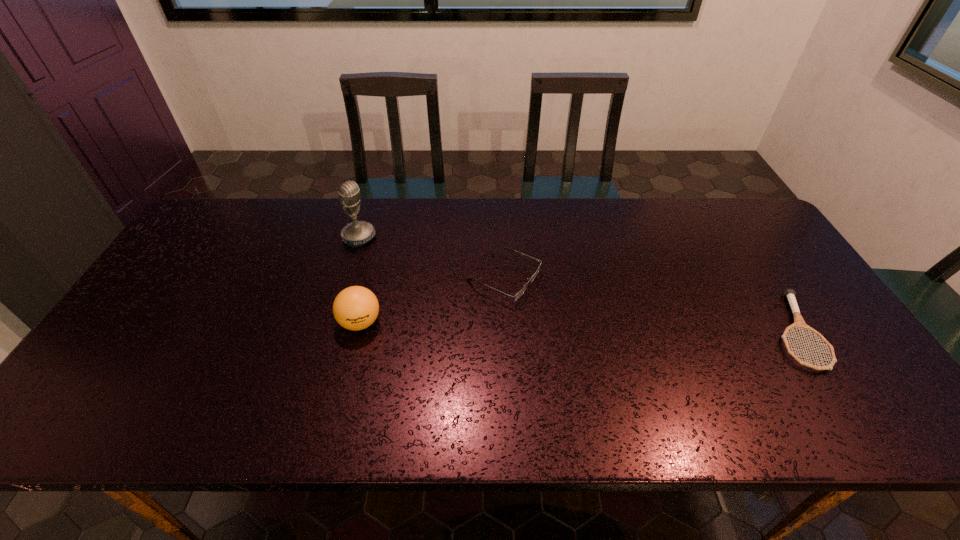
At what (x,y) coordinates should I click in order to perform the action: click on the third shortest object. Please return your answer as a coordinate pair (x, y). The height and width of the screenshot is (540, 960). Looking at the image, I should click on (355, 308).

The width and height of the screenshot is (960, 540). Identify the location of the rightmost object. (790, 294).

Image resolution: width=960 pixels, height=540 pixels. I want to click on the shortest object, so click(790, 294).

What are the coordinates of `the tallest object` in the screenshot? It's located at (357, 233).

You are a GUI agent. You are given a task and a screenshot of the screen. Output one action in this format:
    pyautogui.click(x=<x>, y=<y>)
    Task: Click on the microphone
    The width and height of the screenshot is (960, 540).
    Given the screenshot: What is the action you would take?
    pyautogui.click(x=357, y=233)

The width and height of the screenshot is (960, 540). In order to click on the third tallest object in this screenshot , I will do `click(519, 294)`.

Identify the location of spectacles. (519, 294).

You are a GUI agent. You are given a task and a screenshot of the screen. Output one action in this format:
    pyautogui.click(x=<x>, y=<y>)
    Task: Click on the vacant point located on the side with brand of the second tallest object
    This screenshot has height=540, width=960.
    Given the screenshot: What is the action you would take?
    pyautogui.click(x=348, y=370)

Where is `blank space located 0.320m on the left of the tennis racket`? This screenshot has width=960, height=540. blank space located 0.320m on the left of the tennis racket is located at coordinates (645, 331).

Where is `free point located on the front-facing side of the microphone`? free point located on the front-facing side of the microphone is located at coordinates (408, 266).